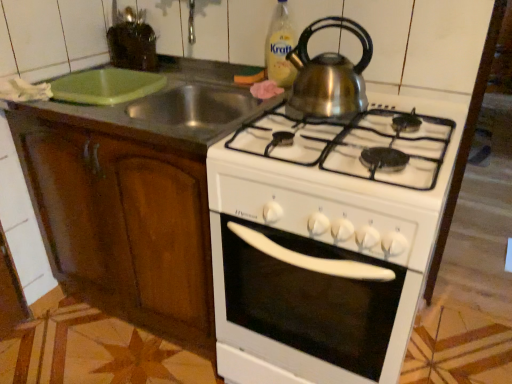
Locate an element on the screen. The image size is (512, 384). white glossy oven at center is located at coordinates 326,240.

What is the approximate width of shiny metallic kettle at upper center?

22.52 centimeters.

You are a GUI agent. You are given a task and a screenshot of the screen. Output one action in this format:
    pyautogui.click(x=<x>, y=<y>)
    Task: Click on the translucent plastic bottle at upper center
    This screenshot has width=512, height=384.
    Given the screenshot: What is the action you would take?
    tap(280, 47)

From the image's perspective, is shiny metallic kettle at upper center below wooden cabinet at left?

No.

Which is nearer, (298, 61) or (118, 195)?

The point (118, 195) is closer to the camera.

How different are the orientations of shiny metallic kettle at upper center and wooden cabinet at left in degrees?

shiny metallic kettle at upper center and wooden cabinet at left are facing 0.000512 degrees away from each other.

Does point (329, 98) come closer to viewer compared to point (273, 42)?

Yes.

Considering the relative sizes of shiny metallic kettle at upper center and translucent plastic bottle at upper center in the image provided, is shiny metallic kettle at upper center bigger than translucent plastic bottle at upper center?

Yes, shiny metallic kettle at upper center is bigger than translucent plastic bottle at upper center.

Between shiny metallic kettle at upper center and translucent plastic bottle at upper center, which one has less height?

shiny metallic kettle at upper center.

From the picture: How far apart are green plastic cutting board at upper left and wooden cabinet at left?

green plastic cutting board at upper left is 12.38 inches away from wooden cabinet at left.

Considering the relative sizes of green plastic cutting board at upper left and wooden cabinet at left in the image provided, is green plastic cutting board at upper left taller than wooden cabinet at left?

No, green plastic cutting board at upper left is not taller than wooden cabinet at left.

Considering their positions, is green plastic cutting board at upper left located in front of or behind wooden cabinet at left?

green plastic cutting board at upper left is positioned closer to the viewer than wooden cabinet at left.

Can you confirm if green plastic cutting board at upper left is bigger than wooden cabinet at left?

Actually, green plastic cutting board at upper left might be smaller than wooden cabinet at left.

Which is behind, wooden cabinet at left or shiny metallic kettle at upper center?

wooden cabinet at left is further from the camera.

The width and height of the screenshot is (512, 384). Identify the location of cabinetry below the shiny metallic kettle at upper center (from a real-world perspective). (123, 220).

Can you confirm if wooden cabinet at left is taller than shiny metallic kettle at upper center?

Yes.

What's the angular difference between wooden cabinet at left and shiny metallic kettle at upper center's facing directions?

There is a 0.000512-degree angle between the facing directions of wooden cabinet at left and shiny metallic kettle at upper center.

Considering the positions of point (156, 236) and point (100, 123), is point (156, 236) closer or farther from the camera than point (100, 123)?

Point (156, 236) is positioned farther from the camera compared to point (100, 123).

Is wooden cabinet at left to the left of green plastic cutting board at upper left from the viewer's perspective?

Incorrect, wooden cabinet at left is not on the left side of green plastic cutting board at upper left.

From the image's perspective, which is above, wooden cabinet at left or green plastic cutting board at upper left?

green plastic cutting board at upper left is shown above in the image.

From a real-world perspective, which object rests below the other?

green plastic cutting board at upper left.

Is translucent plastic bottle at upper center not within green plastic cutting board at upper left?

Yes.

Consider the image. Considering the relative sizes of translucent plastic bottle at upper center and green plastic cutting board at upper left in the image provided, is translucent plastic bottle at upper center thinner than green plastic cutting board at upper left?

Yes.

Considering the relative sizes of translucent plastic bottle at upper center and green plastic cutting board at upper left in the image provided, is translucent plastic bottle at upper center smaller than green plastic cutting board at upper left?

Indeed, translucent plastic bottle at upper center has a smaller size compared to green plastic cutting board at upper left.

What's the angular difference between white glossy oven at center and translucent plastic bottle at upper center's facing directions?

The facing directions of white glossy oven at center and translucent plastic bottle at upper center are 0.68 degrees apart.

Is white glossy oven at center located outside translucent plastic bottle at upper center?

Yes.

Based on the photo, is white glossy oven at center bigger than translucent plastic bottle at upper center?

Yes.

Who is shorter, white glossy oven at center or translucent plastic bottle at upper center?

Standing shorter between the two is translucent plastic bottle at upper center.

Where is `cabinetry on the left of shiny metallic kettle at upper center`? The width and height of the screenshot is (512, 384). cabinetry on the left of shiny metallic kettle at upper center is located at coordinates (123, 220).

You are a GUI agent. You are given a task and a screenshot of the screen. Output one action in this format:
    pyautogui.click(x=<x>, y=<y>)
    Task: Click on the kitchen appliance on the right of translucent plastic bottle at upper center
    The width and height of the screenshot is (512, 384).
    Given the screenshot: What is the action you would take?
    pyautogui.click(x=329, y=74)

Which object lies further to the anchor point wooden cabinet at left, translucent plastic bottle at upper center or shiny metallic kettle at upper center?

The object further to wooden cabinet at left is translucent plastic bottle at upper center.

From the image, which object appears to be farther from green plastic cutting board at upper left, wooden cabinet at left or white glossy oven at center?

Based on the image, white glossy oven at center appears to be further to green plastic cutting board at upper left.

When comparing their distances from translucent plastic bottle at upper center, does green plastic cutting board at upper left or white glossy oven at center seem further?

white glossy oven at center lies further to translucent plastic bottle at upper center than the other object.

Based on their spatial positions, is translucent plastic bottle at upper center or shiny metallic kettle at upper center further from white glossy oven at center?

translucent plastic bottle at upper center.

Which object lies nearer to the anchor point white glossy oven at center, green plastic cutting board at upper left or shiny metallic kettle at upper center?

The object closer to white glossy oven at center is shiny metallic kettle at upper center.

When comparing their distances from translucent plastic bottle at upper center, does white glossy oven at center or shiny metallic kettle at upper center seem closer?

shiny metallic kettle at upper center is closer to translucent plastic bottle at upper center.

Consider the image. Looking at the image, which one is located closer to wooden cabinet at left, translucent plastic bottle at upper center or green plastic cutting board at upper left?

green plastic cutting board at upper left is closer to wooden cabinet at left.

Looking at the image, which one is located further to shiny metallic kettle at upper center, white glossy oven at center or wooden cabinet at left?

wooden cabinet at left is further to shiny metallic kettle at upper center.

The image size is (512, 384). In order to click on counter top between shiny metallic kettle at upper center and white glossy oven at center in the vertical direction in this screenshot , I will do `click(170, 107)`.

Find the location of a particular element. The height and width of the screenshot is (384, 512). kitchen appliance between translucent plastic bottle at upper center and white glossy oven at center in the up-down direction is located at coordinates (329, 74).

In order to click on bottle between wooden cabinet at left and shiny metallic kettle at upper center in this screenshot , I will do `click(280, 47)`.

Identify the location of cabinetry located between green plastic cutting board at upper left and white glossy oven at center in the left-right direction. (123, 220).